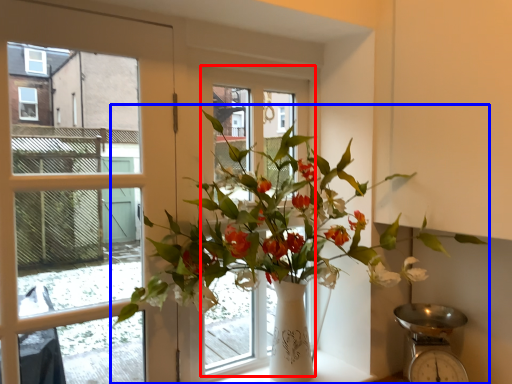
Question: Among these objects, which one is nearest to the camera, window frame (highlighted by a red box) or houseplant (highlighted by a blue box)?

Choices:
 (A) window frame
 (B) houseplant

Answer: (B)